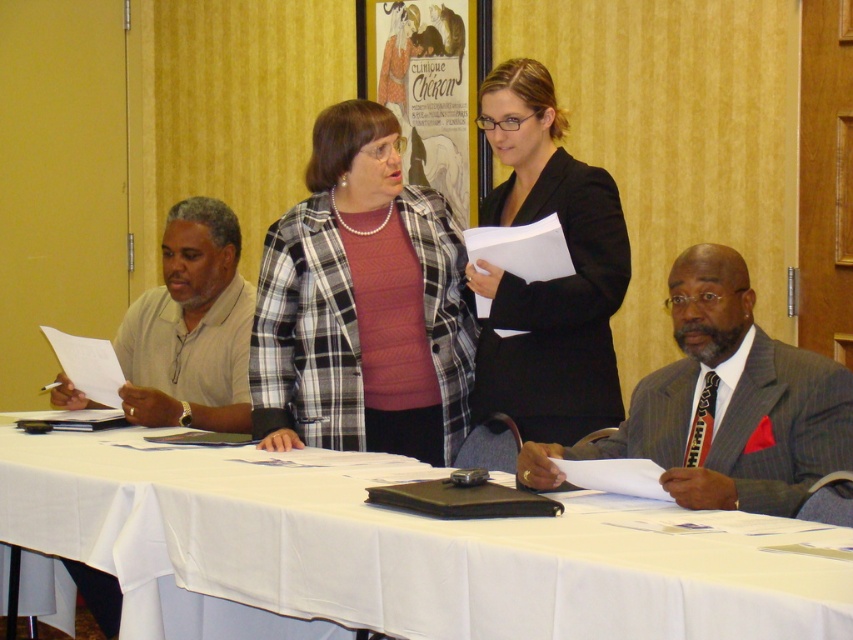
Question: Is black matte blazer at upper center below light beige shirt at left?

Choices:
 (A) yes
 (B) no

Answer: (B)

Question: Where is black matte blazer at upper center located in relation to gray pinstripe suit at lower right in the image?

Choices:
 (A) below
 (B) above

Answer: (B)

Question: Considering the relative positions of black matte blazer at upper center and light beige shirt at left in the image provided, where is black matte blazer at upper center located with respect to light beige shirt at left?

Choices:
 (A) below
 (B) above

Answer: (B)

Question: Which point appears closest to the camera in this image?

Choices:
 (A) (492, 97)
 (B) (262, 589)
 (C) (216, 404)

Answer: (B)

Question: Which of the following is the closest to the observer?

Choices:
 (A) black matte blazer at upper center
 (B) light beige shirt at left
 (C) white cloth at center
 (D) plaid fabric shirt at center

Answer: (C)

Question: Which object is farther from the camera taking this photo?

Choices:
 (A) white cloth at center
 (B) plaid fabric shirt at center

Answer: (B)